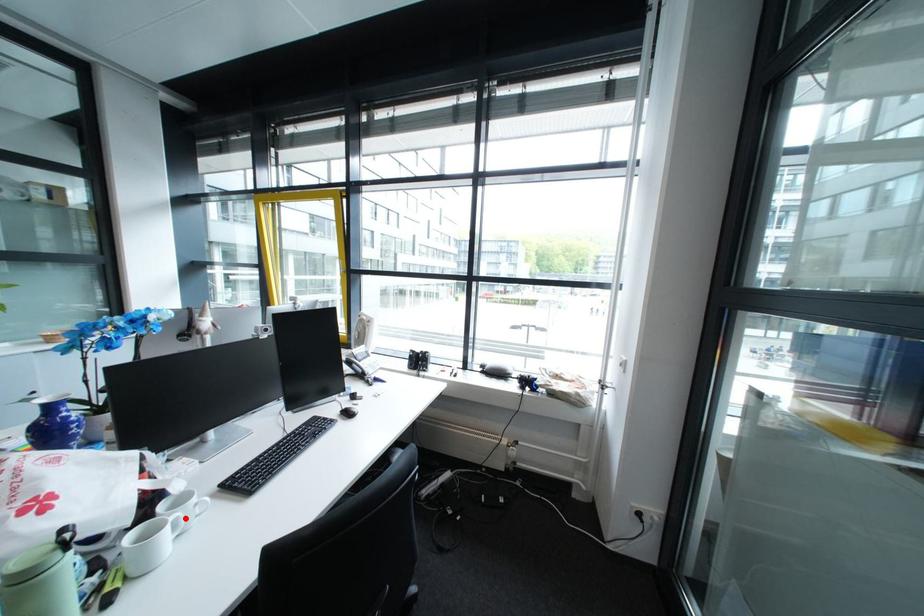
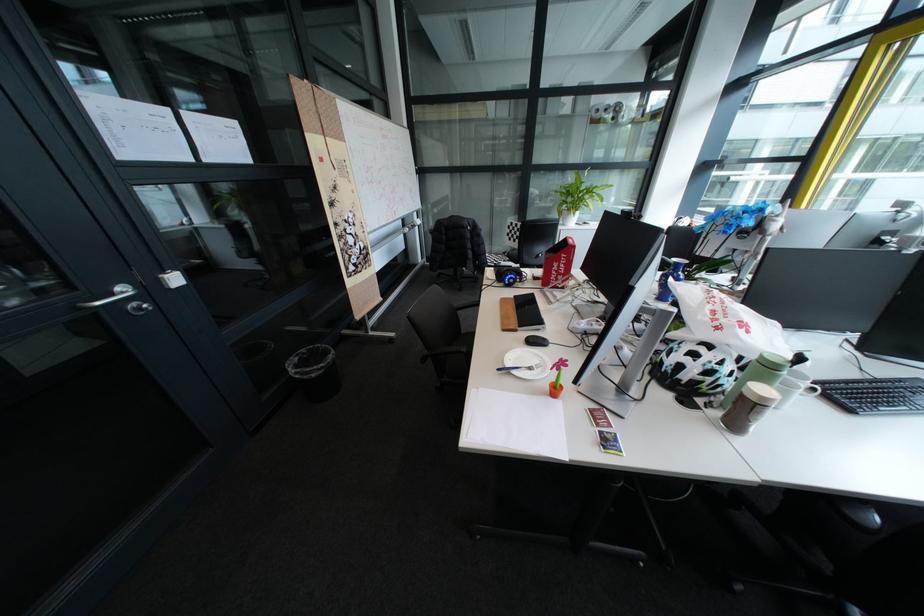
Find the pixel in the second image that matches the highlighted location in the first image.

(815, 386)